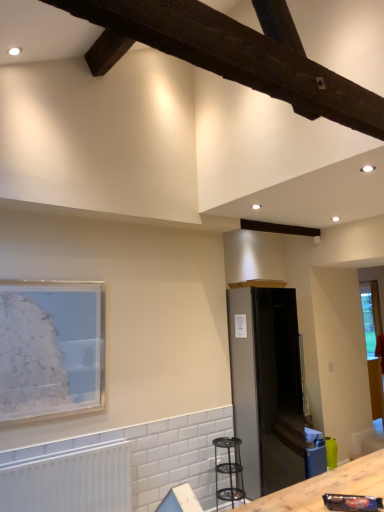
Measure the distance between point (283, 15) and camera.

Point (283, 15) and camera are 5.60 feet apart from each other.

What do you see at coordinates (71, 482) in the screenshot? The height and width of the screenshot is (512, 384). I see `white matte radiator at lower left` at bounding box center [71, 482].

I want to click on satin black refrigerator at center, so click(267, 387).

Which is in front, point (103, 481) or point (84, 334)?

Point (103, 481)

Is matte glass picture frame at left at the back of white matte radiator at lower left?

No, matte glass picture frame at left is not at the back of white matte radiator at lower left.

Does white matte radiator at lower left have a lesser width compared to matte glass picture frame at left?

No.

Choose the correct answer: Is white matte radiator at lower left inside matte glass picture frame at left or outside it?

white matte radiator at lower left is not inside matte glass picture frame at left, it's outside.

Image resolution: width=384 pixels, height=512 pixels. In order to click on radiator lying in front of the metallic black stool at lower center in this screenshot , I will do `click(71, 482)`.

From the image's perspective, who appears lower, white matte radiator at lower left or metallic black stool at lower center?

metallic black stool at lower center is shown below in the image.

What's the angular difference between white matte radiator at lower left and satin black refrigerator at center's facing directions?

The facing directions of white matte radiator at lower left and satin black refrigerator at center are 0.000338 degrees apart.

From the image's perspective, which object appears higher, white matte radiator at lower left or satin black refrigerator at center?

satin black refrigerator at center is shown above in the image.

From a real-world perspective, which is physically above, white matte radiator at lower left or satin black refrigerator at center?

satin black refrigerator at center.

Can you tell me how much matte glass picture frame at left and dark brown wood at upper center differ in facing direction?

The facing directions of matte glass picture frame at left and dark brown wood at upper center are 88.7 degrees apart.

Is matte glass picture frame at left taller or shorter than dark brown wood at upper center?

Clearly, matte glass picture frame at left is taller compared to dark brown wood at upper center.

Does matte glass picture frame at left turn towards dark brown wood at upper center?

Yes, matte glass picture frame at left is aimed at dark brown wood at upper center.

From the image's perspective, is matte glass picture frame at left below dark brown wood at upper center?

Yes, from the image's perspective, matte glass picture frame at left is beneath dark brown wood at upper center.

Is satin black refrigerator at center oriented away from white matte radiator at lower left?

No, satin black refrigerator at center is not facing the opposite direction of white matte radiator at lower left.

Is point (289, 355) farther from viewer compared to point (45, 463)?

Yes, it is.

Are satin black refrigerator at center and white matte radiator at lower left making contact?

No, satin black refrigerator at center is not in contact with white matte radiator at lower left.

In terms of size, does satin black refrigerator at center appear bigger or smaller than white matte radiator at lower left?

In the image, satin black refrigerator at center appears to be larger than white matte radiator at lower left.

Is matte glass picture frame at left not inside metallic black stool at lower center?

Yes, matte glass picture frame at left is not within metallic black stool at lower center.

Does point (23, 355) appear closer or farther from the camera than point (230, 443)?

Point (23, 355) appears to be closer to the viewer than point (230, 443).

From a real-world perspective, which object rests below the other?

metallic black stool at lower center is physically lower.

Who is smaller, matte glass picture frame at left or satin black refrigerator at center?

matte glass picture frame at left is smaller.

Does point (62, 401) appear closer or farther from the camera than point (304, 437)?

Point (62, 401) appears to be closer to the viewer than point (304, 437).

Can you tell me how much matte glass picture frame at left and satin black refrigerator at center differ in facing direction?

The facing directions of matte glass picture frame at left and satin black refrigerator at center are 0.00222 degrees apart.

The image size is (384, 512). I want to click on radiator on the right of matte glass picture frame at left, so click(x=71, y=482).

The width and height of the screenshot is (384, 512). I want to click on bar stool that appears below the white matte radiator at lower left (from the image's perspective), so click(229, 471).

When comparing their distances from dark brown wood at upper center, does satin black refrigerator at center or white matte radiator at lower left seem further?

satin black refrigerator at center lies further to dark brown wood at upper center than the other object.

From the image, which object appears to be nearer to dark brown wood at upper center, matte glass picture frame at left or satin black refrigerator at center?

matte glass picture frame at left is closer to dark brown wood at upper center.

Considering their positions, is satin black refrigerator at center positioned further to dark brown wood at upper center than metallic black stool at lower center?

Based on the image, metallic black stool at lower center appears to be further to dark brown wood at upper center.

Based on their spatial positions, is metallic black stool at lower center or white matte radiator at lower left closer to dark brown wood at upper center?

Based on the image, white matte radiator at lower left appears to be nearer to dark brown wood at upper center.

Estimate the real-world distances between objects in this image. Which object is closer to white matte radiator at lower left, matte glass picture frame at left or metallic black stool at lower center?

matte glass picture frame at left lies closer to white matte radiator at lower left than the other object.

When comparing their distances from matte glass picture frame at left, does metallic black stool at lower center or dark brown wood at upper center seem further?

Based on the image, dark brown wood at upper center appears to be further to matte glass picture frame at left.

When comparing their distances from metallic black stool at lower center, does matte glass picture frame at left or dark brown wood at upper center seem closer?

matte glass picture frame at left lies closer to metallic black stool at lower center than the other object.

Looking at the image, which one is located closer to white matte radiator at lower left, metallic black stool at lower center or satin black refrigerator at center?

metallic black stool at lower center is positioned closer to the anchor white matte radiator at lower left.

The width and height of the screenshot is (384, 512). What are the coordinates of `bar stool between matte glass picture frame at left and satin black refrigerator at center in the horizontal direction` in the screenshot? It's located at (229, 471).

I want to click on picture frame positioned between dark brown wood at upper center and satin black refrigerator at center from near to far, so click(x=51, y=349).

Where is `bar stool positioned between dark brown wood at upper center and satin black refrigerator at center from near to far`? bar stool positioned between dark brown wood at upper center and satin black refrigerator at center from near to far is located at coordinates (229, 471).

In order to click on radiator between dark brown wood at upper center and satin black refrigerator at center in the front-back direction in this screenshot , I will do `click(71, 482)`.